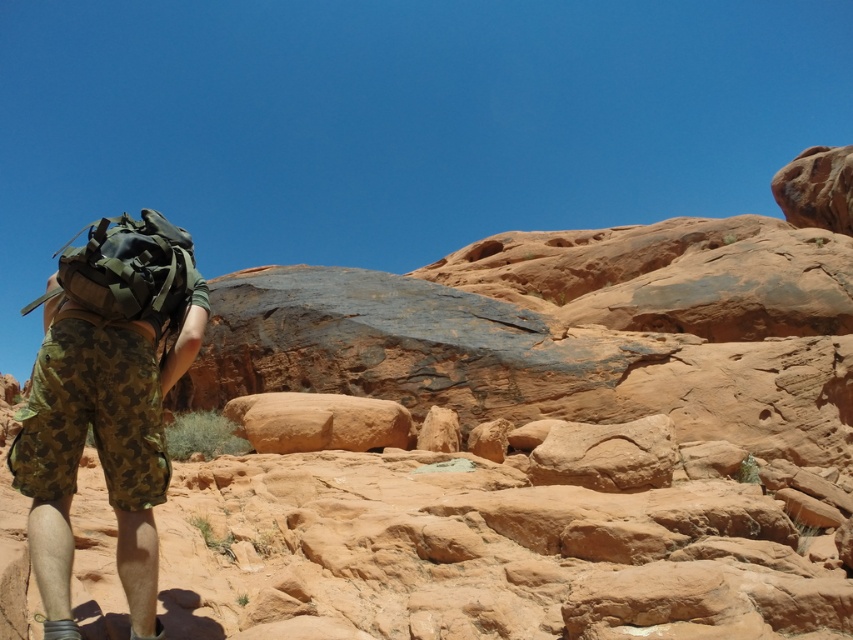
Question: Is camo fabric shorts at lower left above matte green backpack at left?

Choices:
 (A) no
 (B) yes

Answer: (A)

Question: Among these points, which one is farthest from the camera?

Choices:
 (A) (120, 305)
 (B) (32, 493)

Answer: (A)

Question: Which object appears closest to the camera in this image?

Choices:
 (A) matte green backpack at left
 (B) camo fabric shorts at lower left

Answer: (B)

Question: Does camo fabric shorts at lower left appear over matte green backpack at left?

Choices:
 (A) no
 (B) yes

Answer: (A)

Question: Is the position of camo fabric shorts at lower left less distant than that of matte green backpack at left?

Choices:
 (A) yes
 (B) no

Answer: (A)